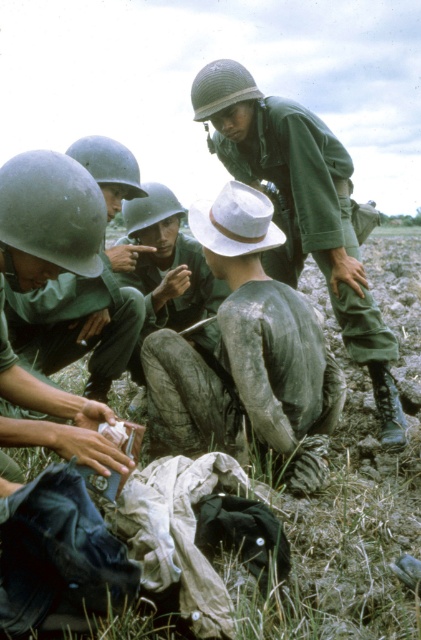
Question: Which of the following is the farthest from the observer?

Choices:
 (A) worn canvas hat at center
 (B) matte green helmet at lower left

Answer: (A)

Question: Which point is closer to the camera?

Choices:
 (A) (319, 484)
 (B) (285, 230)
 (C) (34, 364)

Answer: (A)

Question: Can you confirm if worn canvas hat at center is positioned to the right of green matte helmet at upper center?

Choices:
 (A) no
 (B) yes

Answer: (A)

Question: Can you confirm if worn canvas hat at center is smaller than green matte helmet at upper center?

Choices:
 (A) yes
 (B) no

Answer: (A)

Question: Among these objects, which one is nearest to the camera?

Choices:
 (A) green matte helmet at upper center
 (B) worn canvas hat at center
 (C) matte green helmet at lower left

Answer: (C)

Question: Is worn canvas hat at center closer to the viewer compared to matte green helmet at lower left?

Choices:
 (A) no
 (B) yes

Answer: (A)